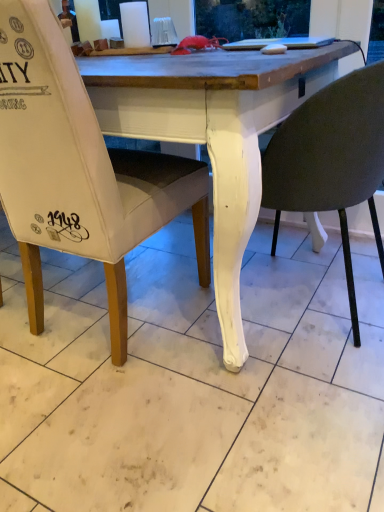
Identify the location of vacant area in front of white matte chair at lower center, which appears as the 2th chair when viewed from the left. The image size is (384, 512). (286, 399).